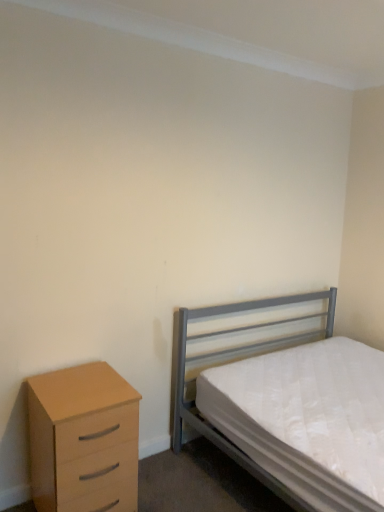
This screenshot has width=384, height=512. Identify the location of blank space situated above light wood/veneer chest of drawers at left (from a real-world perspective). (81, 384).